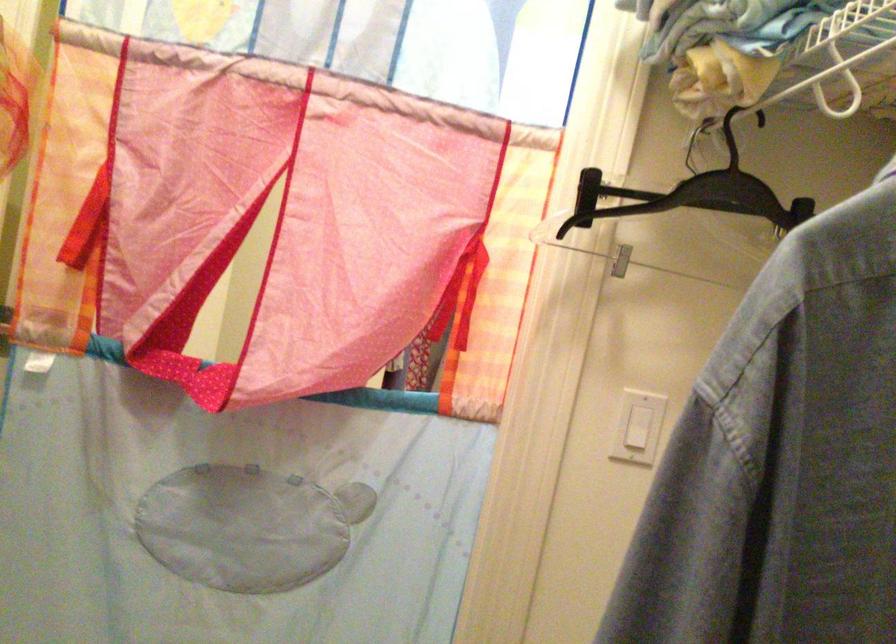
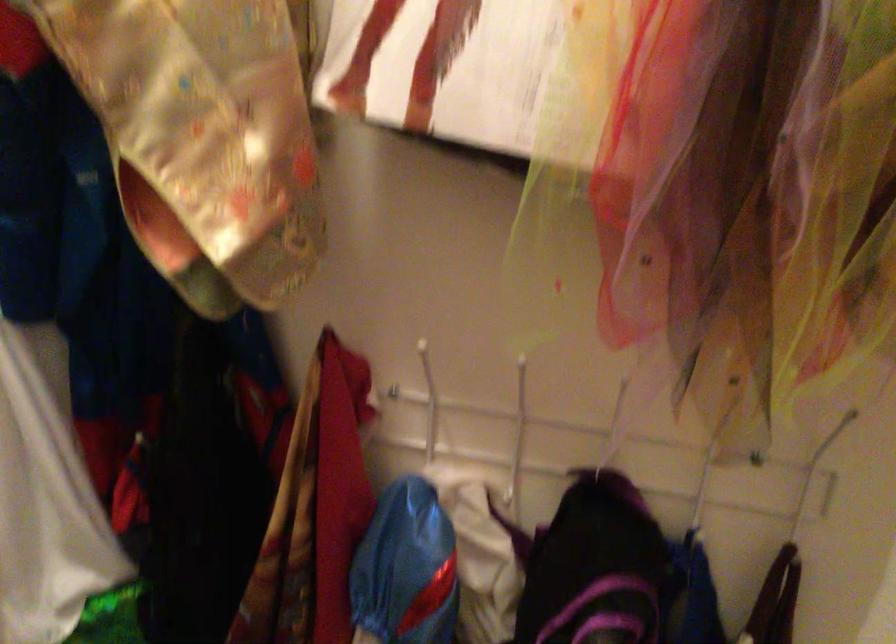
Question: The camera is either moving clockwise (left) or counter-clockwise (right) around the object. The first image is from the beginning of the video and the second image is from the end. Is the camera moving left or right when shooting the video?

Choices:
 (A) Left
 (B) Right

Answer: (B)